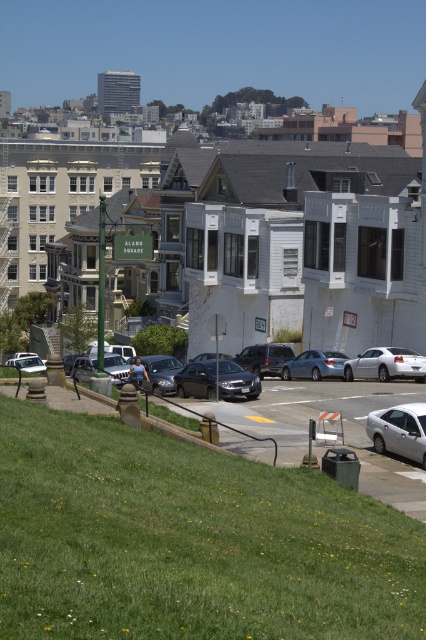
Question: Is green grass at lower left to the right of white glossy sedan at lower left from the viewer's perspective?

Choices:
 (A) no
 (B) yes

Answer: (B)

Question: Which point appears farthest from the camera in this image?

Choices:
 (A) (81, 358)
 (B) (164, 380)
 (C) (314, 376)
 (D) (412, 372)

Answer: (A)

Question: Is green grass at lower left thinner than silver metallic sedan at lower right?

Choices:
 (A) no
 (B) yes

Answer: (A)

Question: Estimate the real-world distances between objects in this image. Which object is closer to the silver metallic sedan at center?

Choices:
 (A) green grass at lower left
 (B) metallic silver sedan at lower left
 (C) shiny silver sedan at center

Answer: (C)

Question: Which of these objects is positioned closest to the satin silver sedan at center?

Choices:
 (A) metallic silver sedan at lower left
 (B) satin black suv at center
 (C) white glossy sedan at lower left
 (D) shiny black sedan at center

Answer: (B)

Question: Is green grass at lower left below shiny silver sedan at center?

Choices:
 (A) yes
 (B) no

Answer: (A)